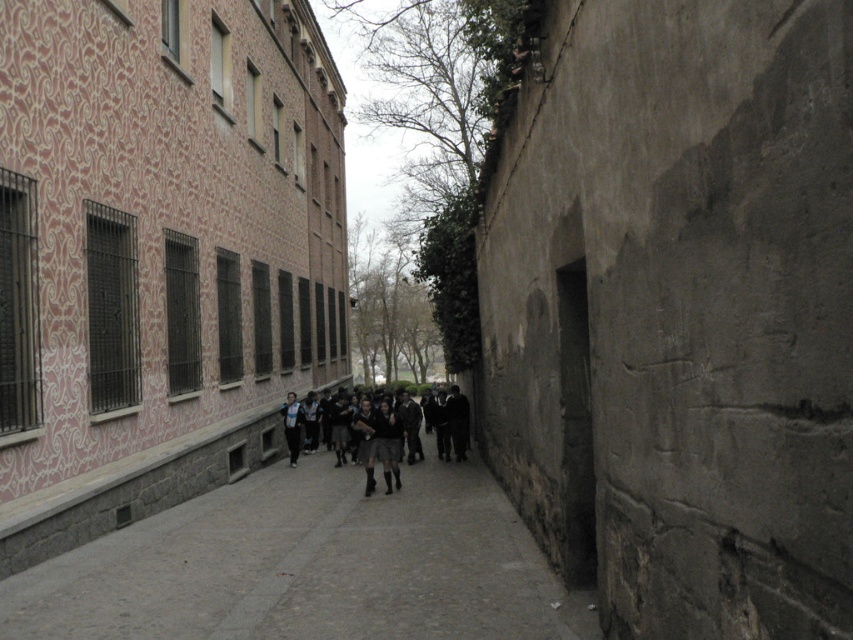
Question: From the image, what is the correct spatial relationship of gray concrete pavement at center in relation to dark gray uniform at center?

Choices:
 (A) left
 (B) right

Answer: (A)

Question: Can you confirm if gray concrete pavement at center is positioned to the left of dark gray uniform at center?

Choices:
 (A) no
 (B) yes

Answer: (B)

Question: Which of the following is the farthest from the observer?

Choices:
 (A) gray concrete pavement at center
 (B) dark gray uniform at center

Answer: (B)

Question: Does gray concrete pavement at center have a smaller size compared to dark gray uniform at center?

Choices:
 (A) no
 (B) yes

Answer: (A)